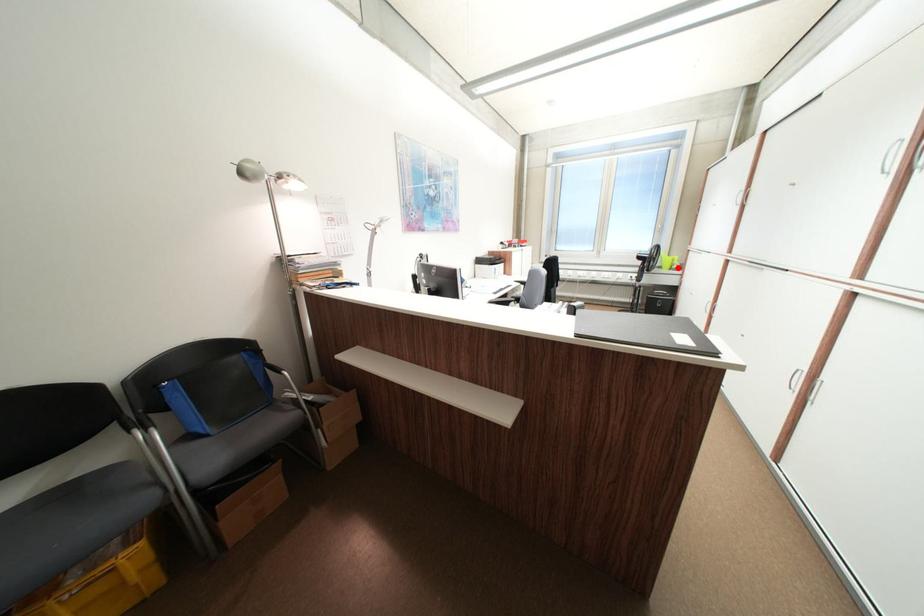
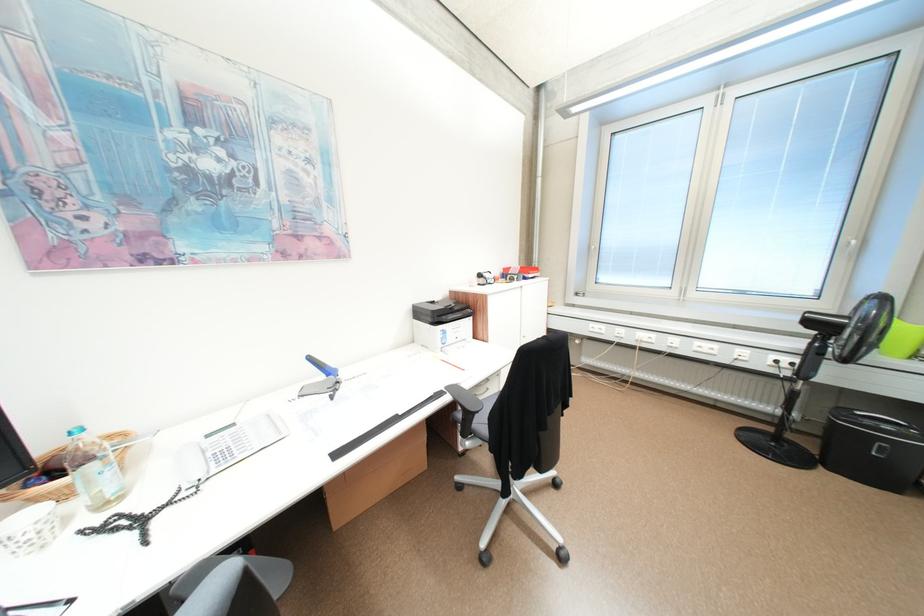
Question: I am providing you with two images of the same scene from different viewpoints. A red point is shown in image1. For the corresponding object point in image2, is it positioned nearer or farther from the camera?

Choices:
 (A) Nearer
 (B) Farther

Answer: (B)